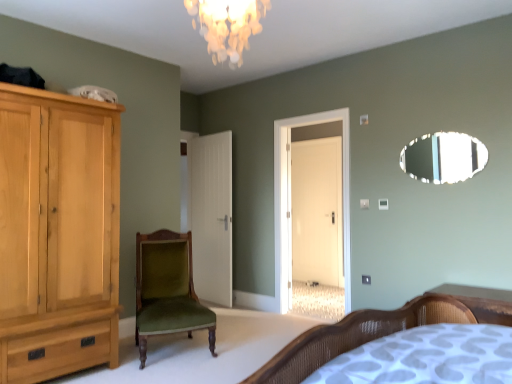
Question: Could you tell me if white matte door at center is turned towards green velvet chair at center?

Choices:
 (A) no
 (B) yes

Answer: (A)

Question: Considering the relative positions of white matte door at center and green velvet chair at center in the image provided, is white matte door at center to the left of green velvet chair at center from the viewer's perspective?

Choices:
 (A) no
 (B) yes

Answer: (A)

Question: Is green velvet chair at center inside white matte door at center?

Choices:
 (A) yes
 (B) no

Answer: (B)

Question: Can you confirm if white matte door at center is positioned to the right of green velvet chair at center?

Choices:
 (A) no
 (B) yes

Answer: (B)

Question: From a real-world perspective, does white matte door at center sit lower than green velvet chair at center?

Choices:
 (A) yes
 (B) no

Answer: (B)

Question: Does white matte door at center have a greater height compared to green velvet chair at center?

Choices:
 (A) no
 (B) yes

Answer: (B)

Question: Considering the relative sizes of iridescent glass chandelier at upper center and white glossy door at center in the image provided, is iridescent glass chandelier at upper center taller than white glossy door at center?

Choices:
 (A) yes
 (B) no

Answer: (B)

Question: Does iridescent glass chandelier at upper center have a greater width compared to white glossy door at center?

Choices:
 (A) yes
 (B) no

Answer: (A)

Question: Considering the relative positions of iridescent glass chandelier at upper center and white glossy door at center in the image provided, is iridescent glass chandelier at upper center in front of white glossy door at center?

Choices:
 (A) no
 (B) yes

Answer: (B)

Question: Could white glossy door at center be considered to be inside iridescent glass chandelier at upper center?

Choices:
 (A) no
 (B) yes

Answer: (A)

Question: Does iridescent glass chandelier at upper center have a lesser width compared to white glossy door at center?

Choices:
 (A) yes
 (B) no

Answer: (B)

Question: From a real-world perspective, is iridescent glass chandelier at upper center physically below white glossy door at center?

Choices:
 (A) yes
 (B) no

Answer: (B)

Question: Is wooden bed at lower right smaller than iridescent glass chandelier at upper center?

Choices:
 (A) yes
 (B) no

Answer: (A)